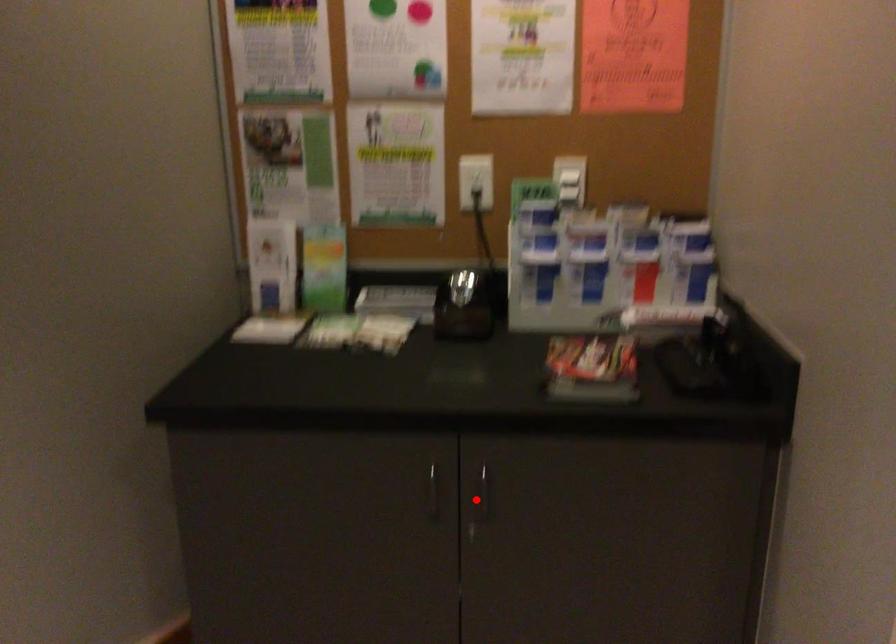
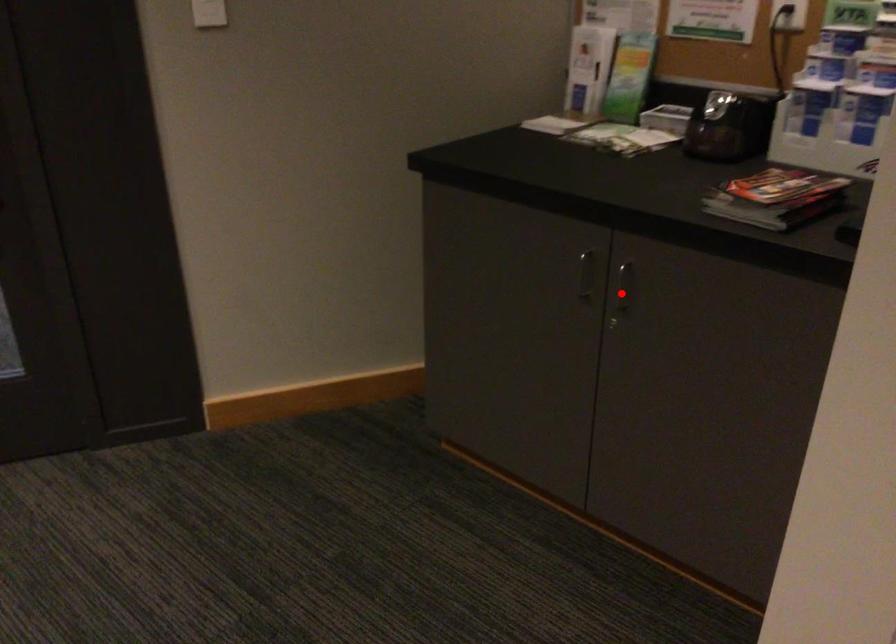
I am providing you with two images of the same scene from different viewpoints. A red point is marked on the first image and another point is marked on the second image. Are the points marked in image1 and image2 representing the same 3D position?

Yes